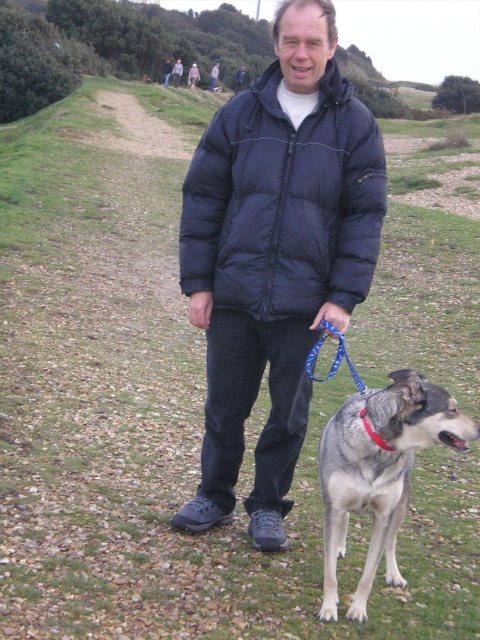
You are standing at the point closer to you in the image. Which point are you at, point (216, 228) or point (392, 451)?

You are at point (216, 228) because it is closer to the viewer than point (392, 451).

You are a GPS device guiding a drone to a specific point in the image. The drone is currently above the dog with a red collar. Which direction should the drone move to reach the point at coordinates point (276, 257)?

The point (276, 257) is on the dark blue puffy jacket at center, so the drone should move towards the center of the image where the man is standing to reach the point.